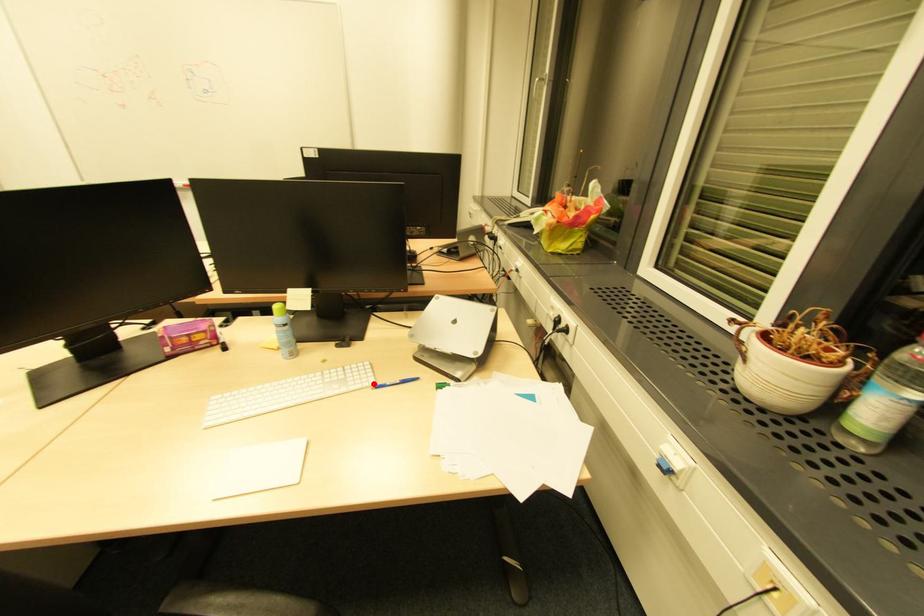
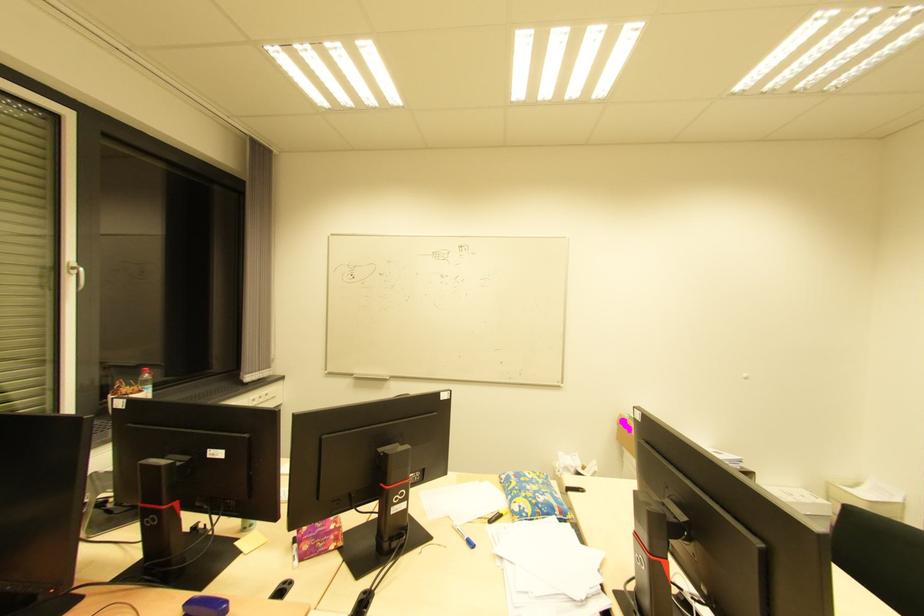
Question: I am providing you with two images of the same scene from different viewpoints. A red point is marked on the first image. Can you still see the location of the red point in image 2?

Choices:
 (A) Yes
 (B) No

Answer: (B)